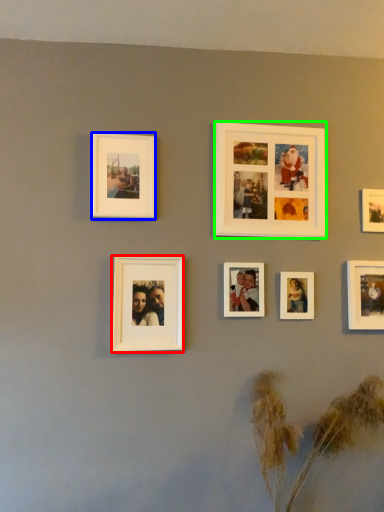
Question: Which object is positioned farthest from picture frame (highlighted by a red box)? Select from picture frame (highlighted by a blue box) and picture frame (highlighted by a green box).

Choices:
 (A) picture frame
 (B) picture frame

Answer: (B)